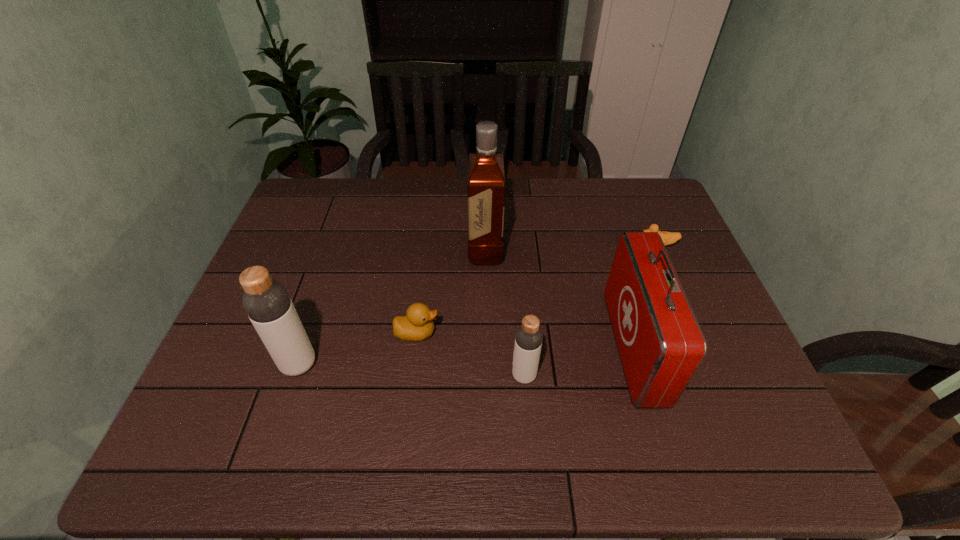
Where is `the first-aid kit`? the first-aid kit is located at coordinates (661, 345).

Locate an element on the screen. This screenshot has width=960, height=540. free region located on the right of the left bottle is located at coordinates (399, 364).

The height and width of the screenshot is (540, 960). In order to click on vacant position located on the back of the right bottle in this screenshot , I will do `click(516, 271)`.

Identify the location of vacant space located 0.090m on the face of the shorter duckling. (608, 247).

At what (x,y) coordinates should I click in order to perform the action: click on free space located on the face of the shorter duckling. Please return your answer as a coordinate pair (x, y). Image resolution: width=960 pixels, height=540 pixels. Looking at the image, I should click on (519, 247).

Image resolution: width=960 pixels, height=540 pixels. Identify the location of free space located on the face of the shorter duckling. (533, 247).

The height and width of the screenshot is (540, 960). In order to click on vacant area situated 0.350m on the front label of the third object from left to right in this screenshot , I will do `click(349, 250)`.

Locate an element on the screen. vacant space located 0.330m on the front label of the third object from left to right is located at coordinates (356, 250).

You are a GUI agent. You are given a task and a screenshot of the screen. Output one action in this format:
    pyautogui.click(x=<x>, y=<y>)
    Task: Click on the vacant space located 0.390m on the front label of the third object from left to right
    
    Given the screenshot: What is the action you would take?
    pyautogui.click(x=336, y=250)

Find the location of a particular element. vacant area located on the face of the left duckling is located at coordinates (516, 333).